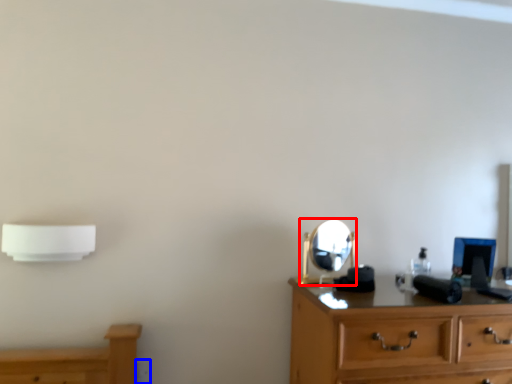
Question: Which object is further to the camera taking this photo, mirror (highlighted by a red box) or electric outlet (highlighted by a blue box)?

Choices:
 (A) mirror
 (B) electric outlet

Answer: (B)